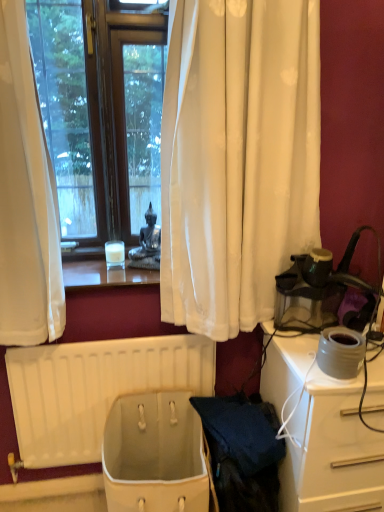
This screenshot has width=384, height=512. Find the location of `free space above white plastic radiator at lower center (from a real-world perspective)`. free space above white plastic radiator at lower center (from a real-world perspective) is located at coordinates click(108, 339).